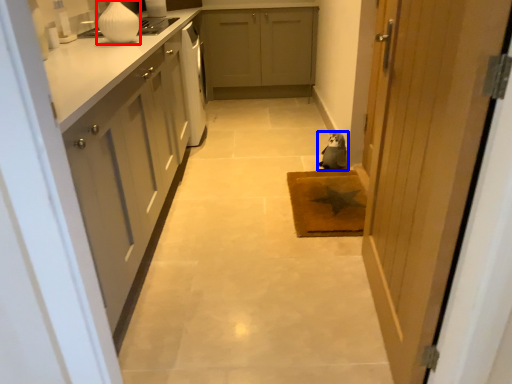
Question: Which of the following is the closest to the observer, vase (highlighted by a red box) or animal (highlighted by a blue box)?

Choices:
 (A) vase
 (B) animal

Answer: (A)